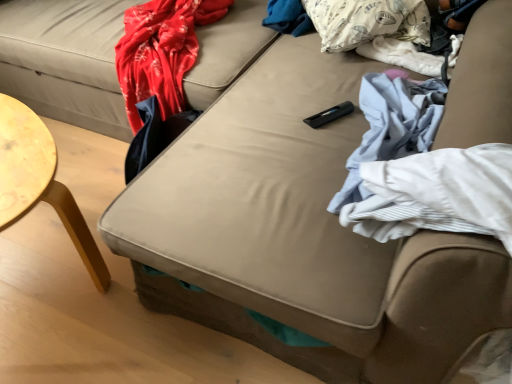
In order to click on white printed pillow at upper right in this screenshot , I will do `click(367, 21)`.

What do you see at coordinates (367, 21) in the screenshot? I see `white printed pillow at upper right` at bounding box center [367, 21].

What do you see at coordinates (391, 126) in the screenshot?
I see `white fabric at right` at bounding box center [391, 126].

The width and height of the screenshot is (512, 384). I want to click on white fabric at right, so 391,126.

I want to click on white printed pillow at upper right, so click(x=367, y=21).

Visually, is white fabric at right positioned to the left or to the right of white printed pillow at upper right?

white fabric at right is positioned on white printed pillow at upper right's right side.

Which object is further away from the camera, white fabric at right or white printed pillow at upper right?

white printed pillow at upper right is behind.

Does point (359, 198) appear closer or farther from the camera than point (326, 48)?

Point (359, 198).

From the image's perspective, is white fabric at right on top of white printed pillow at upper right?

Actually, white fabric at right appears below white printed pillow at upper right in the image.

From a real-world perspective, who is located lower, white fabric at right or white printed pillow at upper right?

From a 3D spatial view, white fabric at right is below.

Between white fabric at right and white printed pillow at upper right, which one has larger width?

white printed pillow at upper right.

Does white fabric at right have a greater height compared to white printed pillow at upper right?

No, white fabric at right is not taller than white printed pillow at upper right.

Can you confirm if white fabric at right is bigger than white printed pillow at upper right?

No.

Is white fabric at right not inside white printed pillow at upper right?

Yes, white fabric at right is located beyond the bounds of white printed pillow at upper right.

Are white fabric at right and white printed pillow at upper right far apart?

Actually, white fabric at right and white printed pillow at upper right are a little close together.

Is white printed pillow at upper right at the back of white fabric at right?

white fabric at right is not turned away from white printed pillow at upper right.

Measure the distance from white fabric at right to white printed pillow at upper right.

white fabric at right and white printed pillow at upper right are 14.19 inches apart from each other.

Identify the location of material below the white printed pillow at upper right (from the image's perspective). (391, 126).

Would you say white printed pillow at upper right is to the left or to the right of white fabric at right in the picture?

Based on their positions, white printed pillow at upper right is located to the left of white fabric at right.

Is white printed pillow at upper right closer to the viewer compared to white fabric at right?

No, white printed pillow at upper right is behind white fabric at right.

Is point (345, 23) closer to camera compared to point (425, 127)?

No, it is not.

From the image's perspective, is white printed pillow at upper right above or below white fabric at right?

From the image's perspective, white printed pillow at upper right appears above white fabric at right.

From a real-world perspective, is white printed pillow at upper right under white fabric at right?

No.

Considering the relative sizes of white printed pillow at upper right and white fabric at right in the image provided, is white printed pillow at upper right thinner than white fabric at right?

No.

Who is shorter, white printed pillow at upper right or white fabric at right?

With less height is white fabric at right.

Does white printed pillow at upper right have a smaller size compared to white fabric at right?

No.

Does white printed pillow at upper right contain white fabric at right?

No.

Is white printed pillow at upper right far away from white fabric at right?

Actually, white printed pillow at upper right and white fabric at right are a little close together.

Is white printed pillow at upper right facing away from white fabric at right?

No, white printed pillow at upper right is not facing the opposite direction of white fabric at right.

How much distance is there between white printed pillow at upper right and white fabric at right?

A distance of 36.04 centimeters exists between white printed pillow at upper right and white fabric at right.

Where is `pillow behind the white fabric at right`? The width and height of the screenshot is (512, 384). pillow behind the white fabric at right is located at coordinates (367, 21).

Image resolution: width=512 pixels, height=384 pixels. What are the coordinates of `pillow located on the left of white fabric at right` in the screenshot? It's located at (367, 21).

I want to click on material lying on the right of white printed pillow at upper right, so click(x=391, y=126).